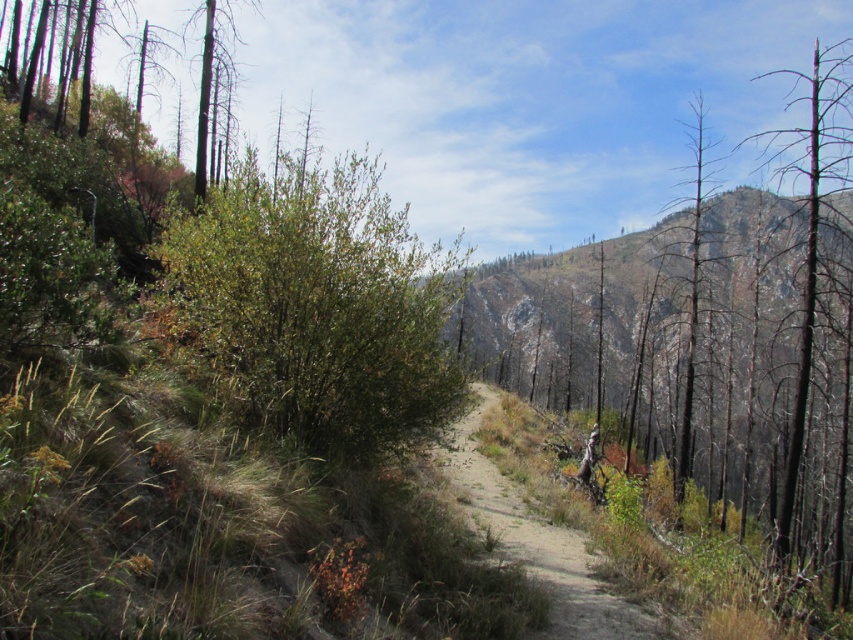
You are planning to walk along the dirt path at center and pass by the charred wood tree at right. Based on their widths, which one is narrower?

The dirt path at center is narrower than the charred wood tree at right.

You are a hiker planning to walk along the dirt path at center. There is a green leafy bush at center in your way. Can you walk under it without bending down?

The green leafy bush at center is above the dirt path at center, so yes, you can walk under it without bending down.